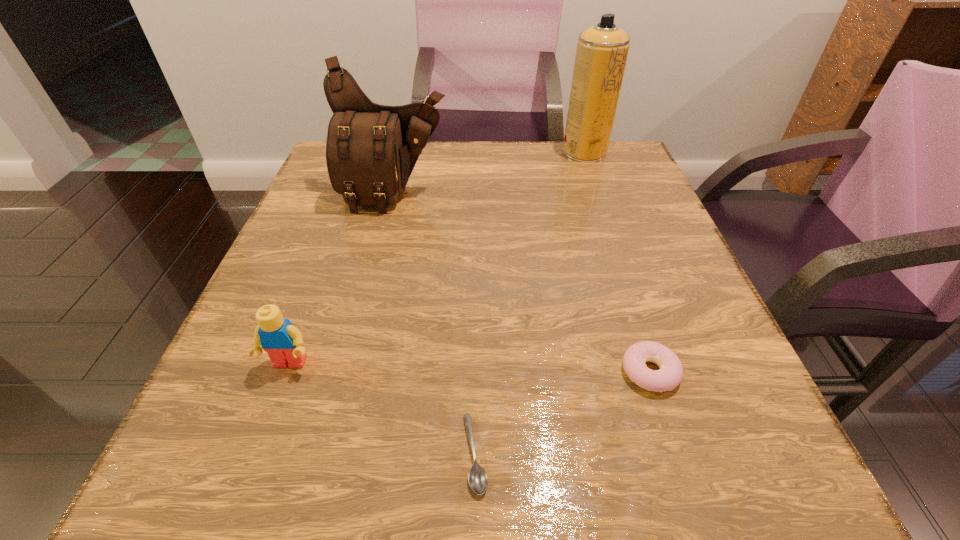
Locate an element on the screen. This screenshot has width=960, height=540. free space between the second shortest object and the shoulder bag is located at coordinates (522, 284).

Find the location of a particular element. free space between the Lego and the shoulder bag is located at coordinates (342, 280).

Where is `unoccupied position between the farthest object and the second farthest object`? unoccupied position between the farthest object and the second farthest object is located at coordinates (490, 173).

What are the coordinates of `empty space between the aerosol can and the third shortest object` in the screenshot? It's located at (437, 258).

You are a GUI agent. You are given a task and a screenshot of the screen. Output one action in this format:
    pyautogui.click(x=<x>, y=<y>)
    Task: Click on the unoccupied area between the Lego and the doughnut
    This screenshot has height=540, width=960.
    Given the screenshot: What is the action you would take?
    [x=469, y=368]

Locate which object ranks second in proximity to the doughnut. Please provide its 2D coordinates. Your answer should be formatted as a tuple, i.e. [(x, y)], where the tuple contains the x and y coordinates of a point satisfying the conditions above.

[(371, 150)]

The width and height of the screenshot is (960, 540). Find the location of `object that is the fourth closest to the soupspoon`. object that is the fourth closest to the soupspoon is located at coordinates (602, 50).

Find the location of a particular element. vacant space that satisfies the following two spatial constraints: 1. on the front-facing side of the third tallest object; 2. on the right side of the doughnut is located at coordinates (286, 372).

The width and height of the screenshot is (960, 540). Find the location of `vacant point that satisfies the following two spatial constraints: 1. on the front-facing side of the shoulder bag; 2. on the left side of the nearest object`. vacant point that satisfies the following two spatial constraints: 1. on the front-facing side of the shoulder bag; 2. on the left side of the nearest object is located at coordinates (330, 453).

The width and height of the screenshot is (960, 540). I want to click on free location that satisfies the following two spatial constraints: 1. on the front-facing side of the Lego; 2. on the left side of the fourth tallest object, so click(x=286, y=372).